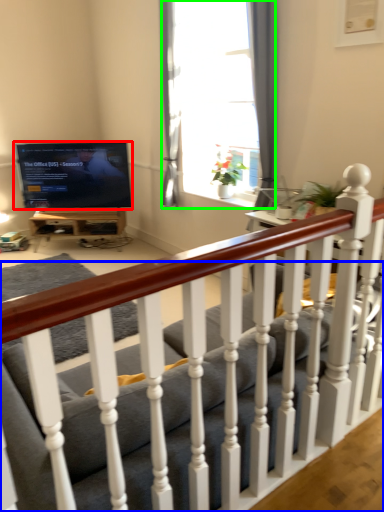
Question: Based on their relative distances, which object is farther from television (highlighted by a red box)? Choose from studio couch (highlighted by a blue box) and window (highlighted by a green box).

Choices:
 (A) studio couch
 (B) window

Answer: (A)